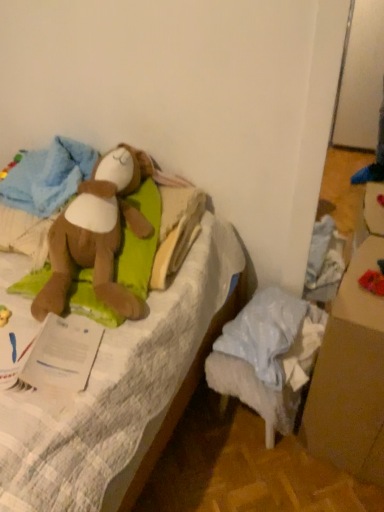
What is the approximate width of white paper at left?

It is 21.39 centimeters.

Where is `brown cardboard box at lower right`? brown cardboard box at lower right is located at coordinates point(350,376).

The width and height of the screenshot is (384, 512). In order to click on brown plush toy at upper left in this screenshot , I will do (x=107, y=343).

Is brown cardboard box at lower right facing away from brown plush toy at upper left?

brown cardboard box at lower right is not turned away from brown plush toy at upper left.

Where is `furniture in front of the brown cardboard box at lower right`? furniture in front of the brown cardboard box at lower right is located at coordinates (107, 343).

From the image's perspective, is brown cardboard box at lower right located above or below brown plush toy at upper left?

From the image's perspective, brown cardboard box at lower right appears below brown plush toy at upper left.

Who is bigger, brown cardboard box at lower right or brown plush toy at upper left?

brown plush toy at upper left is bigger.

Which object is positioned more to the left, brown cardboard box at lower right or white paper at left?

white paper at left.

Is brown cardboard box at lower right facing away from white paper at left?

No, white paper at left is not at the back of brown cardboard box at lower right.

Is brown cardboard box at lower right completely or partially outside of white paper at left?

brown cardboard box at lower right lies outside white paper at left's area.

Find the location of `cardboard box in front of the red fabric toy at lower right, the first toy in the right-to-left sequence`. cardboard box in front of the red fabric toy at lower right, the first toy in the right-to-left sequence is located at coordinates (350, 376).

Is point (370, 287) positioned behind point (365, 254)?

No, (370, 287) is closer to viewer.

How far apart are red fabric toy at lower right, the first toy in the right-to-left sequence, and brown cardboard box at lower right?

red fabric toy at lower right, the first toy in the right-to-left sequence, and brown cardboard box at lower right are 10.47 inches apart from each other.

Is red fabric toy at lower right, arranged as the second toy when viewed from the left, further to camera compared to brown cardboard box at lower right?

Yes, red fabric toy at lower right, arranged as the second toy when viewed from the left, is further from the camera.

Would you say brown cardboard box at lower right contains red fabric toy at lower right, arranged as the second toy when viewed from the left?

Yes, red fabric toy at lower right, arranged as the second toy when viewed from the left, is surrounded by brown cardboard box at lower right.

Is brown cardboard box at lower right facing towards red fabric toy at lower right, the first toy in the right-to-left sequence?

No, brown cardboard box at lower right is not turned towards red fabric toy at lower right, the first toy in the right-to-left sequence.

Looking at this image, can you tell me how much brown cardboard box at lower right and red fabric toy at lower right, arranged as the second toy when viewed from the left, differ in facing direction?

The angular difference between brown cardboard box at lower right and red fabric toy at lower right, arranged as the second toy when viewed from the left, is 12.1 degrees.

Is brown plush toy at upper left not inside white paper at left?

Yes, brown plush toy at upper left is not within white paper at left.

At what (x,y) coordinates should I click in order to perform the action: click on paper located on the right of brown plush toy at upper left. Please return your answer as a coordinate pair (x, y). Looking at the image, I should click on (63, 353).

Considering the sizes of brown plush toy at upper left and white paper at left in the image, is brown plush toy at upper left wider or thinner than white paper at left?

Considering their sizes, brown plush toy at upper left looks broader than white paper at left.

Between white paper at left and brown plush toy at upper left, which one has more height?

With more height is brown plush toy at upper left.

How many degrees apart are the facing directions of white paper at left and brown plush toy at upper left?

The angular difference between white paper at left and brown plush toy at upper left is 69 degrees.

Which is more to the right, white paper at left or brown plush toy at upper left?

From the viewer's perspective, white paper at left appears more on the right side.

Which of these two, brown plush toy at left, which is counted as the second toy, starting from the right, or white paper at left, is wider?

With larger width is brown plush toy at left, which is counted as the second toy, starting from the right.

Does brown plush toy at left, which is counted as the second toy, starting from the right, have a smaller size compared to white paper at left?

No, brown plush toy at left, which is counted as the second toy, starting from the right, is not smaller than white paper at left.

Considering the relative positions of brown plush toy at left, acting as the first toy starting from the left, and white paper at left in the image provided, is brown plush toy at left, acting as the first toy starting from the left, to the right of white paper at left from the viewer's perspective?

In fact, brown plush toy at left, acting as the first toy starting from the left, is to the left of white paper at left.

Find the location of a particular element. This screenshot has height=512, width=384. cardboard box on the right of brown plush toy at upper left is located at coordinates (350, 376).

You are a GUI agent. You are given a task and a screenshot of the screen. Output one action in this format:
    pyautogui.click(x=<x>, y=<y>)
    Task: Click on the paper above the brown cardboard box at lower right (from the image's perspective)
    
    Given the screenshot: What is the action you would take?
    63,353

Considering their positions, is brown cardboard box at lower right positioned further to brown plush toy at upper left than white paper at left?

The object further to brown plush toy at upper left is brown cardboard box at lower right.

Which object lies further to the anchor point brown plush toy at left, acting as the first toy starting from the left, brown plush toy at upper left or red fabric toy at lower right, the first toy in the right-to-left sequence?

red fabric toy at lower right, the first toy in the right-to-left sequence, lies further to brown plush toy at left, acting as the first toy starting from the left, than the other object.

Which object lies nearer to the anchor point brown plush toy at upper left, white paper at left or brown plush toy at left, acting as the first toy starting from the left?

Based on the image, brown plush toy at left, acting as the first toy starting from the left, appears to be nearer to brown plush toy at upper left.

Estimate the real-world distances between objects in this image. Which object is closer to brown plush toy at left, acting as the first toy starting from the left, white paper at left or red fabric toy at lower right, arranged as the second toy when viewed from the left?

white paper at left is positioned closer to the anchor brown plush toy at left, acting as the first toy starting from the left.

Looking at the image, which one is located closer to white paper at left, brown plush toy at left, acting as the first toy starting from the left, or red fabric toy at lower right, arranged as the second toy when viewed from the left?

brown plush toy at left, acting as the first toy starting from the left, is closer to white paper at left.

Which object lies further to the anchor point brown plush toy at left, acting as the first toy starting from the left, brown cardboard box at lower right or white paper at left?

brown cardboard box at lower right is further to brown plush toy at left, acting as the first toy starting from the left.

Considering their positions, is white paper at left positioned closer to brown plush toy at left, acting as the first toy starting from the left, than brown cardboard box at lower right?

Based on the image, white paper at left appears to be nearer to brown plush toy at left, acting as the first toy starting from the left.

Considering their positions, is brown cardboard box at lower right positioned further to white paper at left than brown plush toy at upper left?

brown cardboard box at lower right lies further to white paper at left than the other object.

You are a GUI agent. You are given a task and a screenshot of the screen. Output one action in this format:
    pyautogui.click(x=<x>, y=<y>)
    Task: Click on the paper situated between brown plush toy at upper left and brown cardboard box at lower right from left to right
    Image resolution: width=384 pixels, height=512 pixels.
    Given the screenshot: What is the action you would take?
    pyautogui.click(x=63, y=353)

Locate an element on the screen. toy situated between brown plush toy at left, which is counted as the second toy, starting from the right, and brown cardboard box at lower right from left to right is located at coordinates (373, 280).

I want to click on paper situated between brown plush toy at left, which is counted as the second toy, starting from the right, and red fabric toy at lower right, the first toy in the right-to-left sequence, from left to right, so click(63, 353).

Locate an element on the screen. paper between brown plush toy at upper left and red fabric toy at lower right, the first toy in the right-to-left sequence, from left to right is located at coordinates (63, 353).